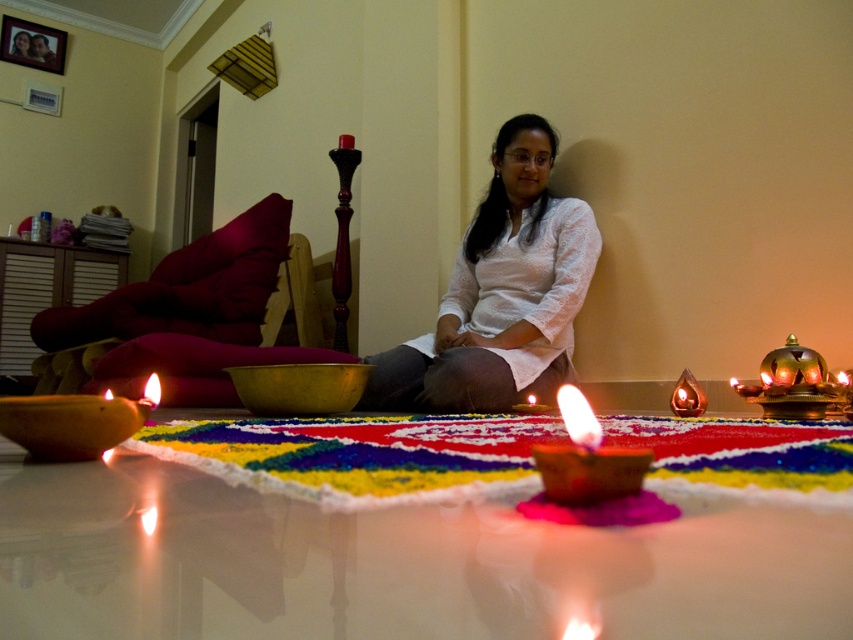
You are standing in the festive scene and want to place a decoration between the two points, point (x=524, y=164) and point (x=258, y=36). Which point should you start from to ensure the decoration is closer to the camera?

You should start from point (x=524, y=164) because it is closer to the camera than point (x=258, y=36).

You are organizing a small gathering and need to place a decorative item on a table that can only accommodate items narrower than the white textured shirt at center. Can the matte brown candle at lower center fit on the table?

The white textured shirt at center is wider than the matte brown candle at lower center. Since the table can only accommodate items narrower than the shirt, the matte brown candle at lower center can fit on the table as it is narrower.

You are standing in the center of the room and want to place a small decoration exactly where the white textured shirt at center is located. Is this location suitable for placing the decoration?

The white textured shirt at center is located at point (500, 292), so yes, the location is suitable for placing the decoration as it is precisely at that coordinate.